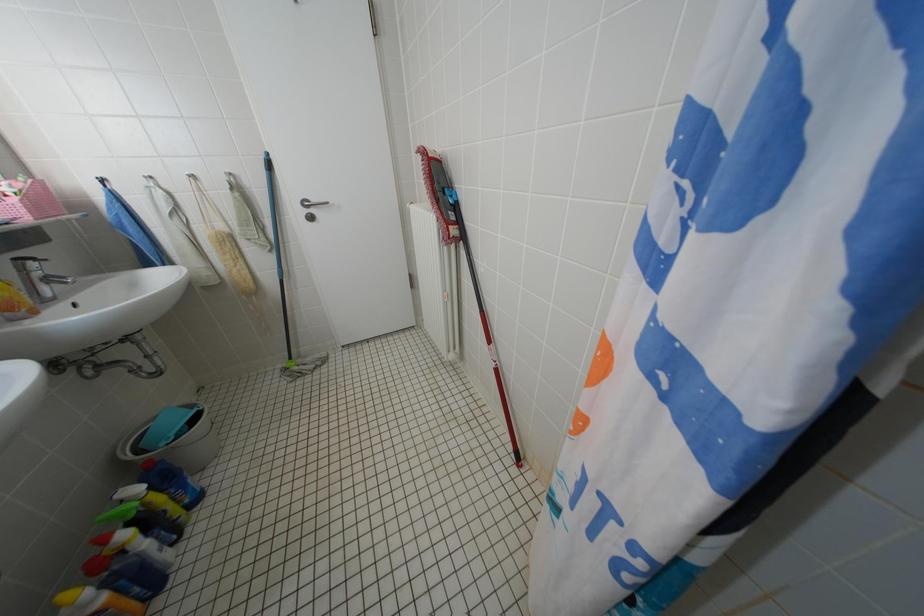
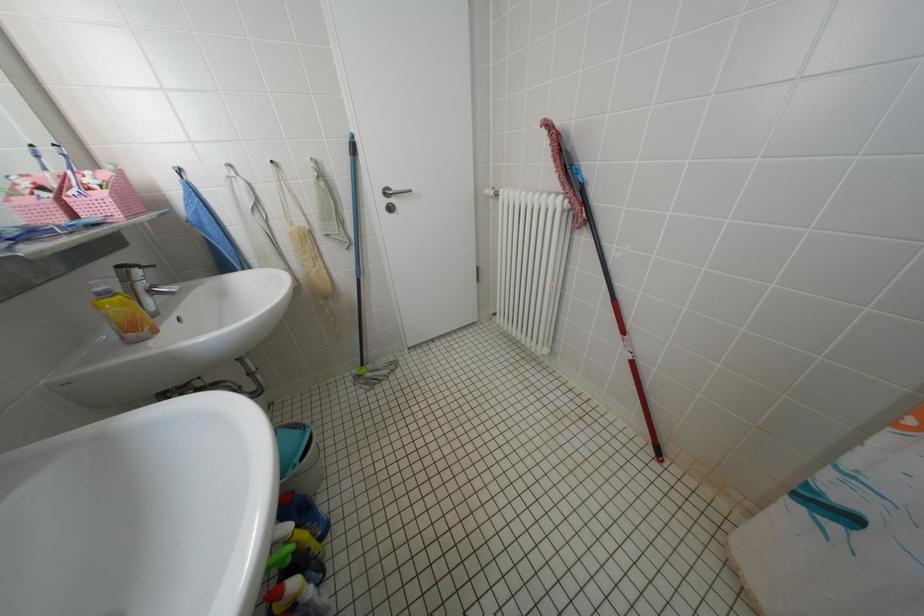
Question: What movement of the cameraman would produce the second image?

Choices:
 (A) Left
 (B) Right
 (C) Forward
 (D) Backward

Answer: (A)